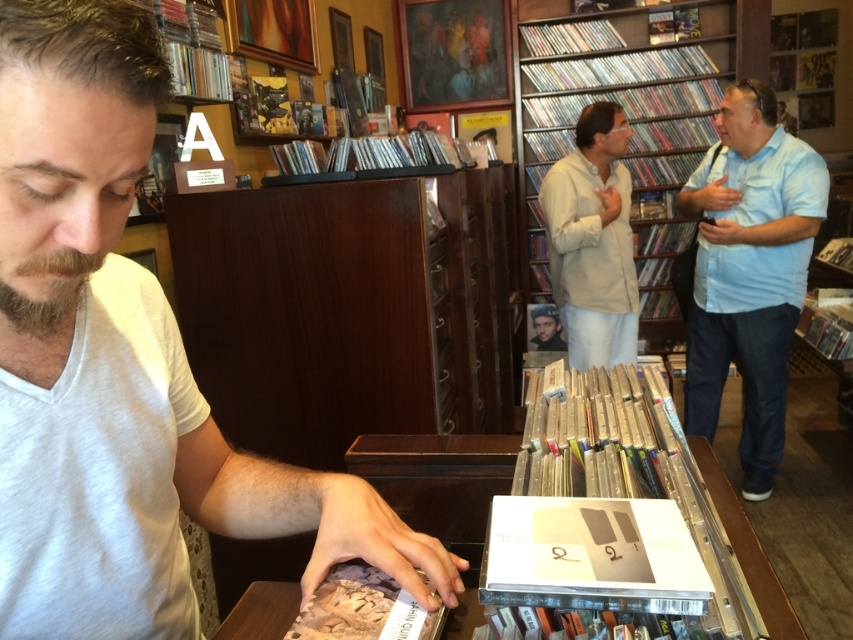
Question: Which is nearer to the matte black book at center?

Choices:
 (A) shiny gold hair at center
 (B) light blue shirt at right

Answer: (B)

Question: Among these points, which one is nearest to the camera?

Choices:
 (A) click(349, 628)
 (B) click(811, 301)
 (C) click(500, 605)
 (D) click(20, 308)

Answer: (D)

Question: Does wooden bookshelf at center appear under light blue shirt at right?

Choices:
 (A) no
 (B) yes

Answer: (A)

Question: Is brown fuzzy beard at lower left closer to the viewer compared to matte black book at center?

Choices:
 (A) yes
 (B) no

Answer: (A)

Question: Which point appears closest to the camera in this image?

Choices:
 (A) (372, 620)
 (B) (701, 67)

Answer: (A)

Question: Observing the image, what is the correct spatial positioning of hardcover book at center in reference to matte black book at center?

Choices:
 (A) above
 (B) below

Answer: (B)